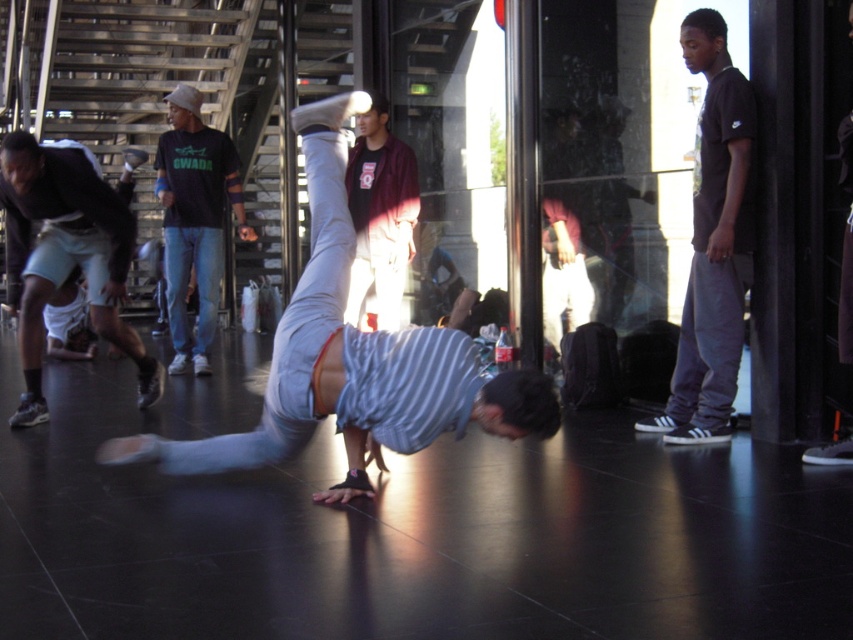
Identify the location of black matte shirt at right. This screenshot has width=853, height=640. (712, 244).

Who is more distant from viewer, (x=706, y=272) or (x=850, y=209)?

The point (x=706, y=272) is behind.

I want to click on black matte shirt at right, so click(x=712, y=244).

Is point (376, 374) farther from viewer compared to point (811, 458)?

No.

Which is below, striped cotton shirt at center or dark gray pants at right?

striped cotton shirt at center is below.

Does point (352, 248) come in front of point (834, 442)?

Yes, it is in front of point (834, 442).

Identify the location of striped cotton shirt at center. This screenshot has width=853, height=640. pos(352,358).

Does point (15, 275) lie behind point (190, 115)?

No, (15, 275) is in front of (190, 115).

Is point (120, 264) positioned in front of point (230, 177)?

Yes, point (120, 264) is closer to viewer.

Where is `light blue denim shorts at lower left`? The image size is (853, 640). light blue denim shorts at lower left is located at coordinates (65, 256).